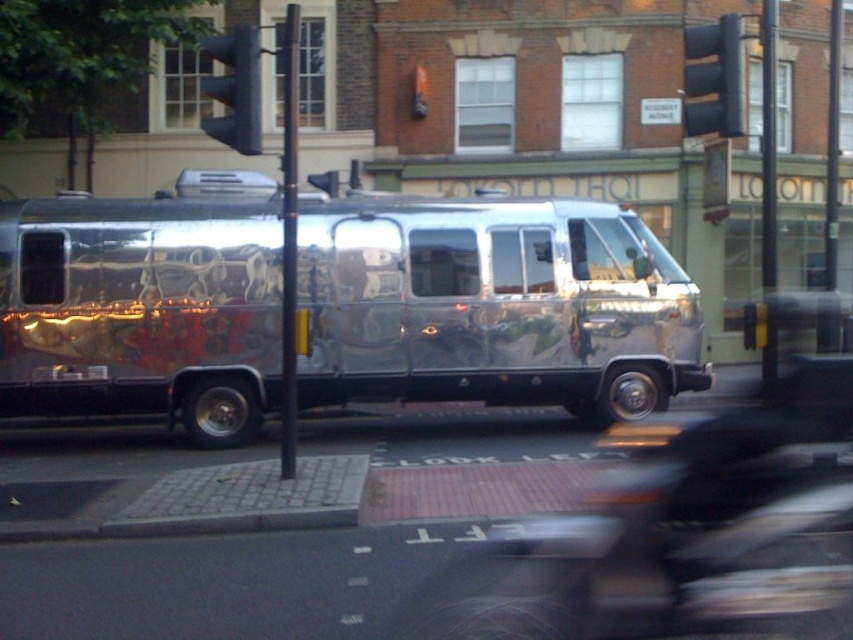
Describe the element at coordinates (712, 77) in the screenshot. I see `black plastic traffic light at upper right` at that location.

Looking at this image, between black plastic traffic light at upper right and blue plastic traffic light at upper center, which one has less height?

With less height is blue plastic traffic light at upper center.

Is point (717, 88) positioned behind point (245, 38)?

Yes, it is behind point (245, 38).

I want to click on black plastic traffic light at upper right, so click(712, 77).

Is shiny metallic van at center wider than black plastic traffic light at upper right?

No, shiny metallic van at center is not wider than black plastic traffic light at upper right.

Can you confirm if shiny metallic van at center is smaller than black plastic traffic light at upper right?

Yes.

Does point (389, 330) lie behind point (703, 124)?

That is True.

The height and width of the screenshot is (640, 853). Find the location of `shiny metallic van at center`. shiny metallic van at center is located at coordinates (492, 305).

From the picture: Can you confirm if shiny metallic van at center is thinner than blue plastic traffic light at upper center?

Yes.

Is point (625, 397) closer to camera compared to point (236, 80)?

No, it is not.

Find the location of a particular element. shiny metallic van at center is located at coordinates (492, 305).